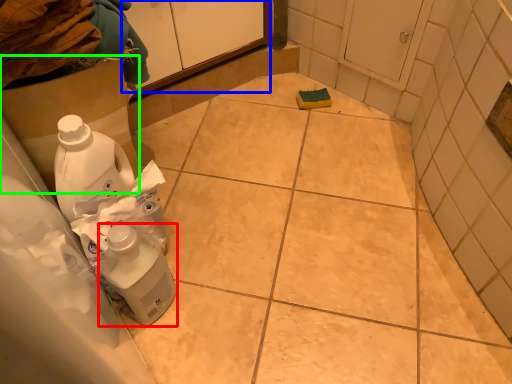
Question: Which object is the closest to the cleaning product (highlighted by a red box)? Choose among these: cabinetry (highlighted by a blue box) or cardboard box (highlighted by a green box).

Choices:
 (A) cabinetry
 (B) cardboard box

Answer: (B)